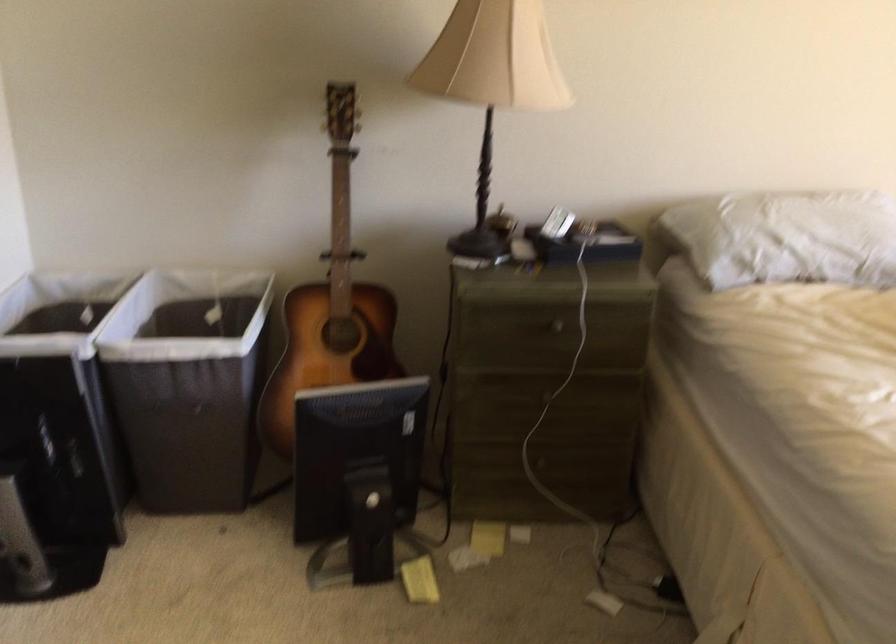
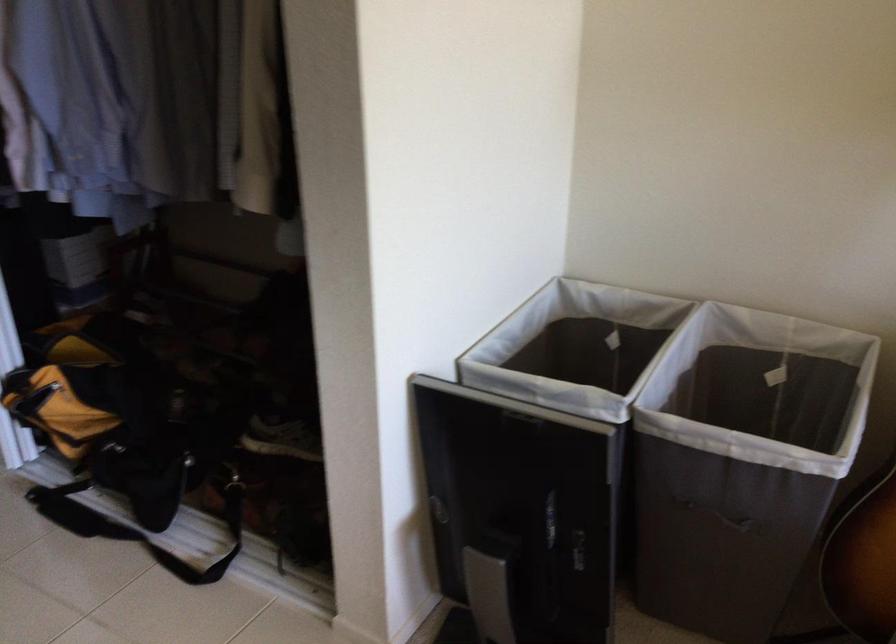
The point at (190,365) is marked in the first image. Where is the corresponding point in the second image?

(742, 462)